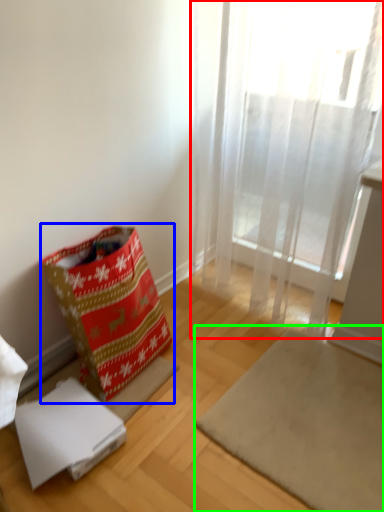
Question: Based on their relative distances, which object is farther from curtain (highlighted by a red box)? Choose from gift bag (highlighted by a blue box) and mat (highlighted by a green box).

Choices:
 (A) gift bag
 (B) mat

Answer: (A)